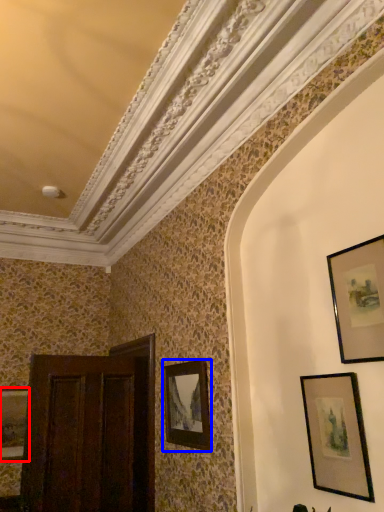
Question: Which of the following is the closest to the observer, picture frame (highlighted by a red box) or picture frame (highlighted by a blue box)?

Choices:
 (A) picture frame
 (B) picture frame

Answer: (B)